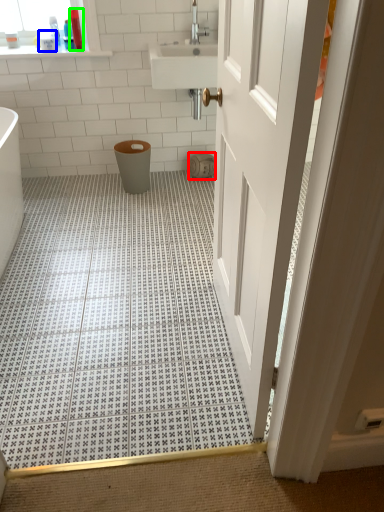
Question: Based on their relative distances, which object is nearer to toilet paper (highlighted by a red box)? Choose from toiletry (highlighted by a blue box) and toiletry (highlighted by a green box).

Choices:
 (A) toiletry
 (B) toiletry

Answer: (B)